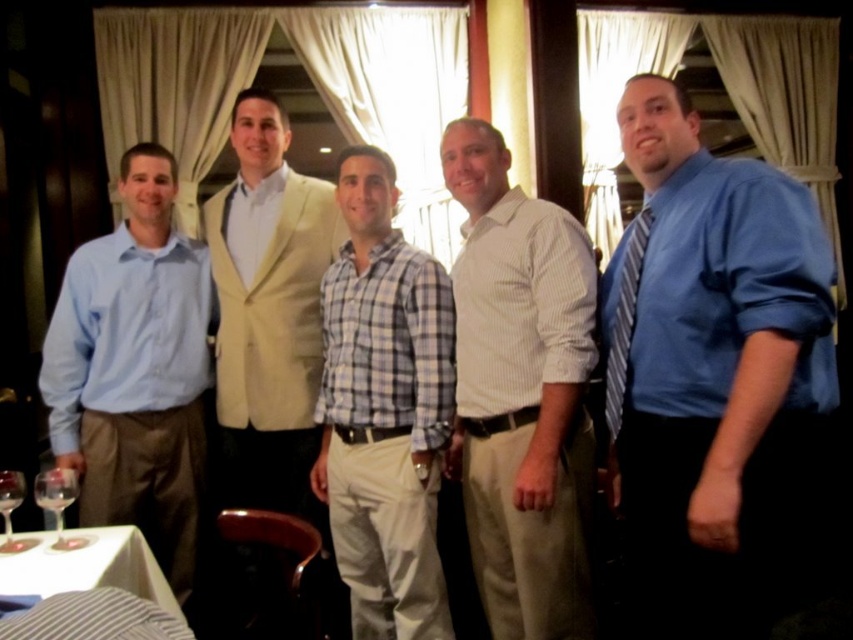
You are a photographer at the event and need to capture a photo of the two men in the center. The white striped shirt at center and the light blue checkered shirt at center. Your camera has a focus setting that can only focus on objects at the same height. Can you adjust the camera to focus on both shirts simultaneously?

The white striped shirt at center is above the light blue checkered shirt at center, so they are not at the same height. Therefore, the camera cannot focus on both shirts simultaneously unless adjusted to a different focus point.

You are organizing a charity event and need to decide which item to place on the podium. The podium can only accommodate one item. Given the blue satin shirt at center and the striped fabric tie at right, which one would you choose based on their sizes?

The blue satin shirt at center is larger in size than the striped fabric tie at right, so you should choose the blue satin shirt at center for the podium since it can better fill the space.